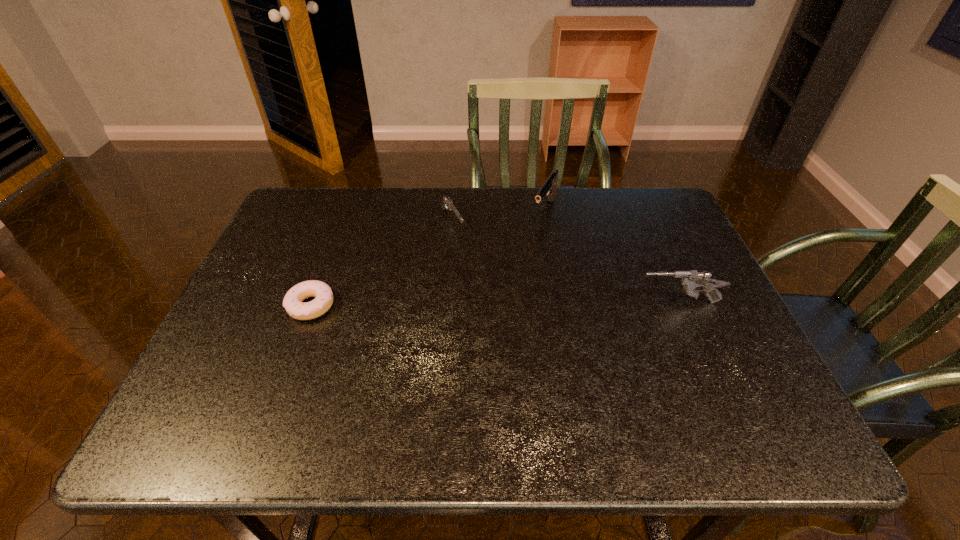
Where is `vacant space situated at the barrel of the rightmost object`? vacant space situated at the barrel of the rightmost object is located at coordinates (521, 302).

Locate an element on the screen. The width and height of the screenshot is (960, 540). free space located 0.340m on the front-facing side of the left pistol is located at coordinates (510, 320).

Where is `free location located on the front-facing side of the left pistol`? This screenshot has width=960, height=540. free location located on the front-facing side of the left pistol is located at coordinates (489, 287).

Locate an element on the screen. vacant position located on the front-facing side of the left pistol is located at coordinates (518, 333).

The height and width of the screenshot is (540, 960). In order to click on free point located at the muzzle of the third object from left to right in this screenshot , I will do `click(491, 306)`.

At what (x,y) coordinates should I click in order to perform the action: click on vacant space located 0.210m at the muzzle of the third object from left to right. Please return your answer as a coordinate pair (x, y). The image size is (960, 540). Looking at the image, I should click on (514, 268).

Locate an element on the screen. Image resolution: width=960 pixels, height=540 pixels. free spot located at the muzzle of the third object from left to right is located at coordinates (523, 252).

Locate an element on the screen. Image resolution: width=960 pixels, height=540 pixels. object present at the left edge is located at coordinates (292, 302).

What are the coordinates of `object at the right edge` in the screenshot? It's located at (692, 279).

Locate an element on the screen. The width and height of the screenshot is (960, 540). free point at the far edge is located at coordinates (575, 195).